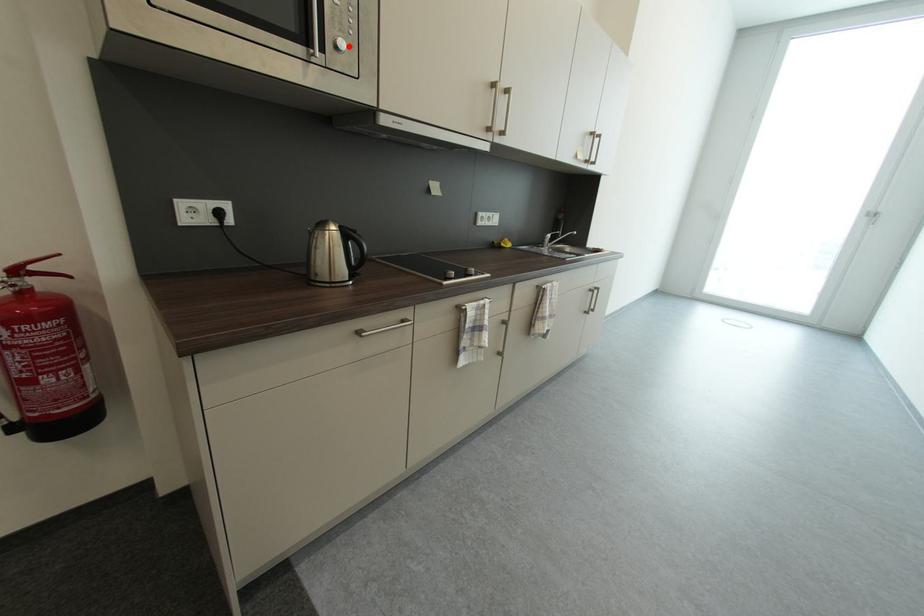
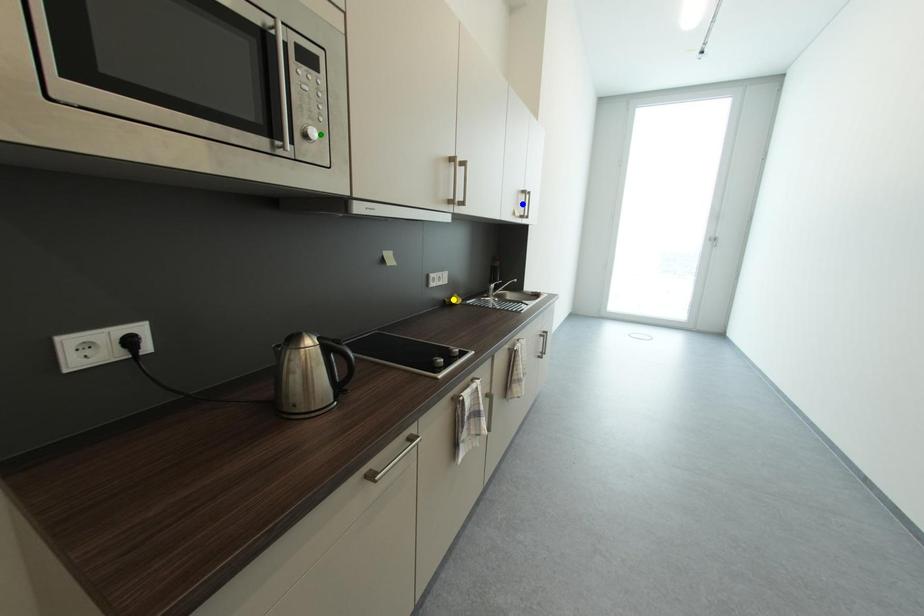
Question: I am providing you with two images of the same scene from different viewpoints. A red point is marked on the first image. You are given multiple points on the second image. Which mark in image 2 goes with the point in image 1?

Choices:
 (A) yellow point
 (B) blue point
 (C) green point

Answer: (C)